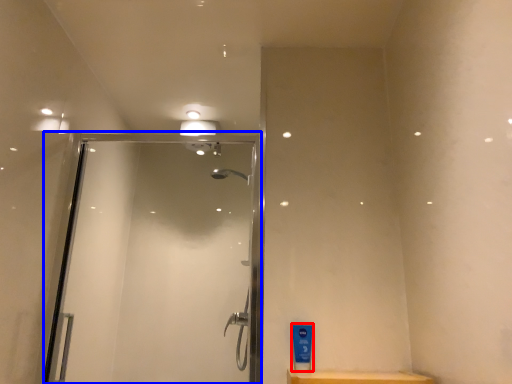
Question: Among these objects, which one is farthest to the camera, toiletry (highlighted by a red box) or screen door (highlighted by a blue box)?

Choices:
 (A) toiletry
 (B) screen door

Answer: (B)